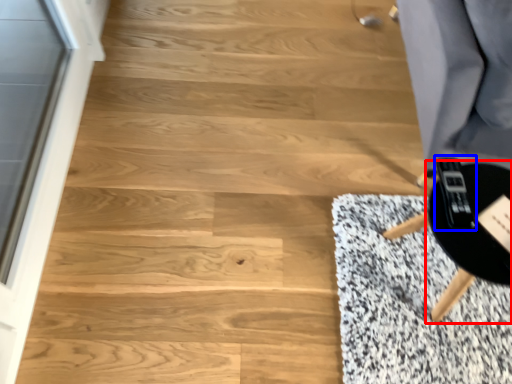
Question: Which object appears farthest to the camera in this image, round table (highlighted by a red box) or game controller (highlighted by a blue box)?

Choices:
 (A) round table
 (B) game controller

Answer: (B)